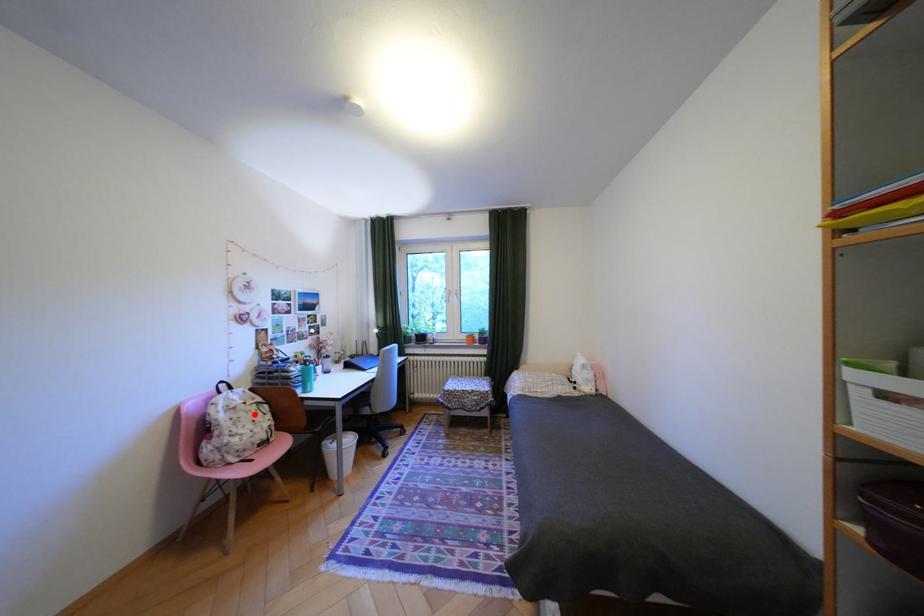
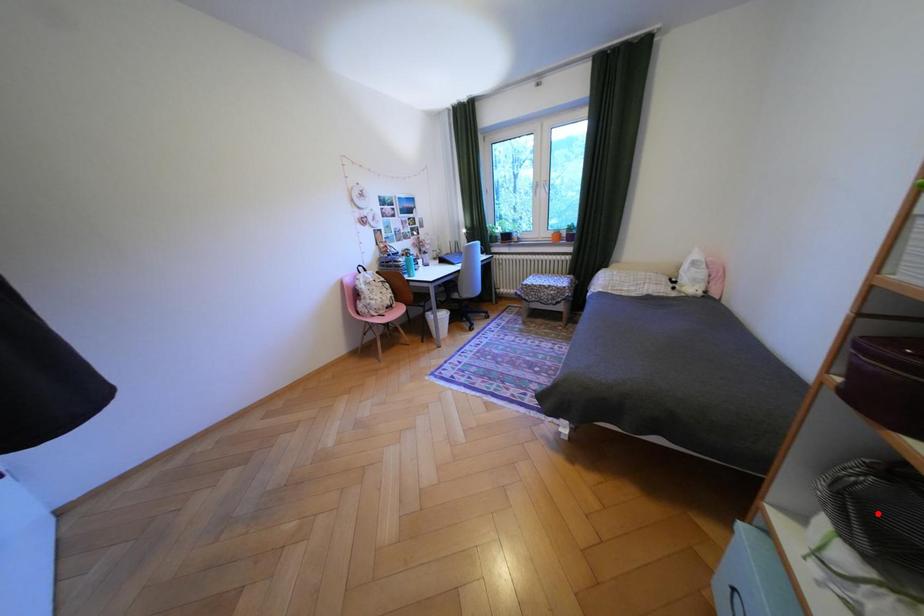
I am providing you with two images of the same scene from different viewpoints. A red point is marked on the first image and another point is marked on the second image. Do the highlighted points in image1 and image2 indicate the same real-world spot?

No